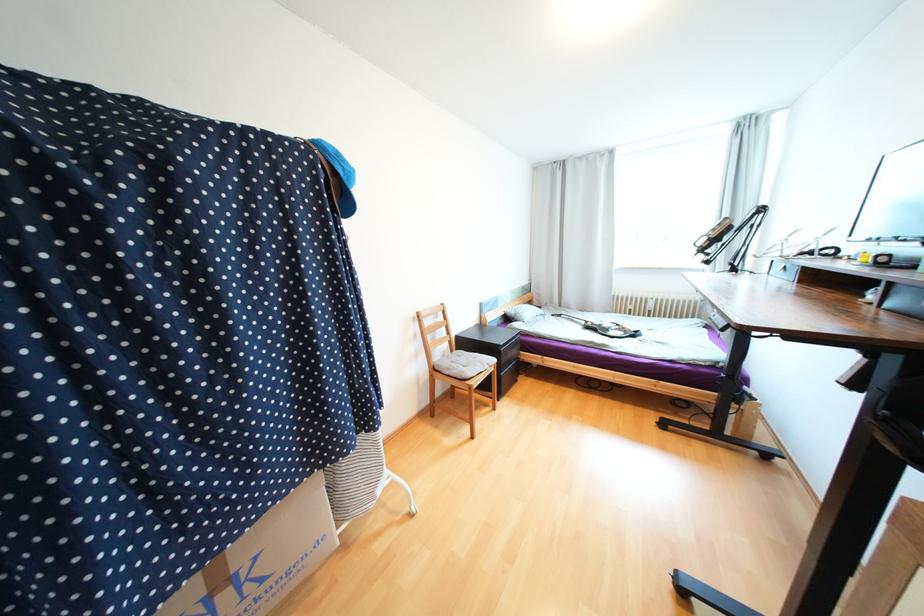
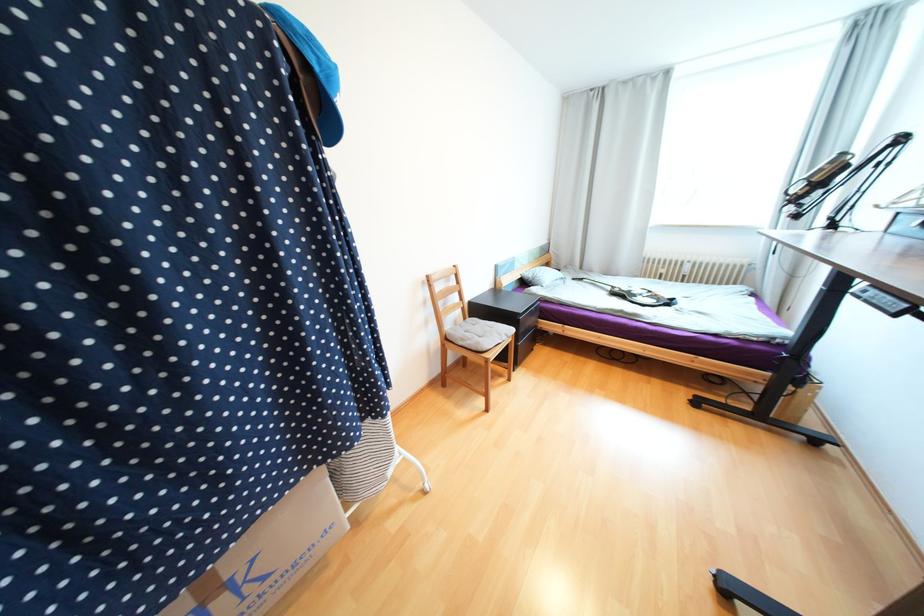
Find the pixel in the second image that matches point 521,315 in the first image.

(540, 278)